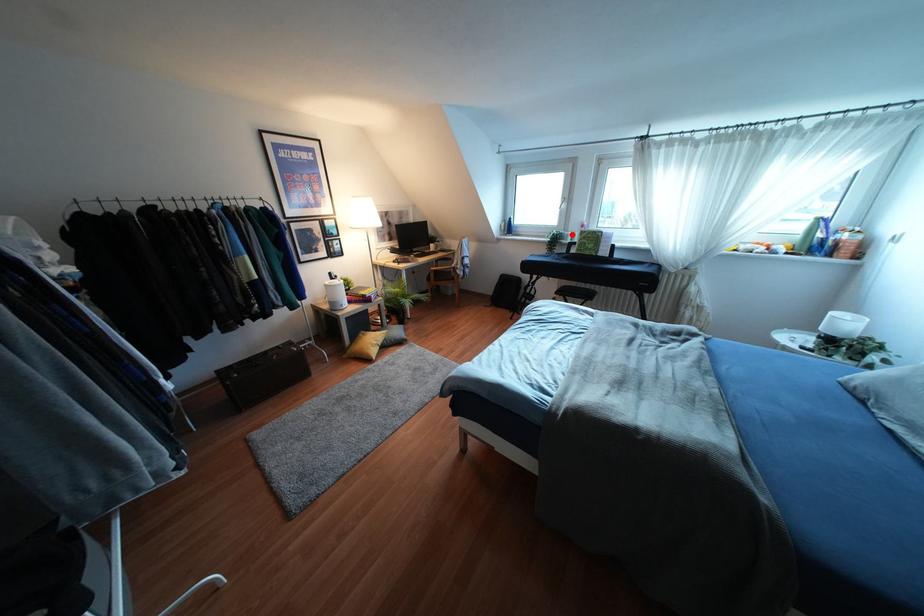
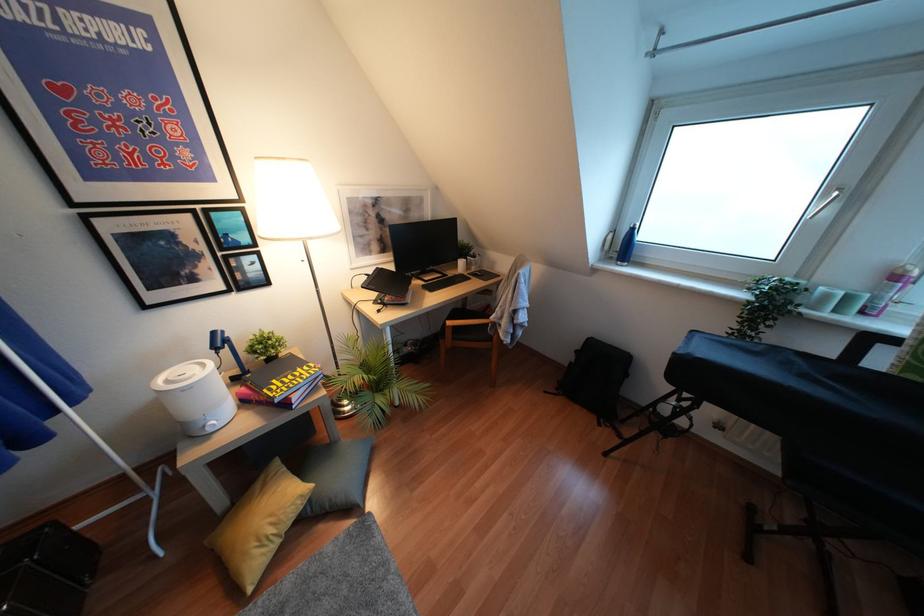
Question: I am providing you with two images of the same scene from different viewpoints. Image1 has a red point marked. In image2, the corresponding 3D location appears at what relative position? Reply with the corresponding letter.

Choices:
 (A) Closer
 (B) Farther

Answer: (B)